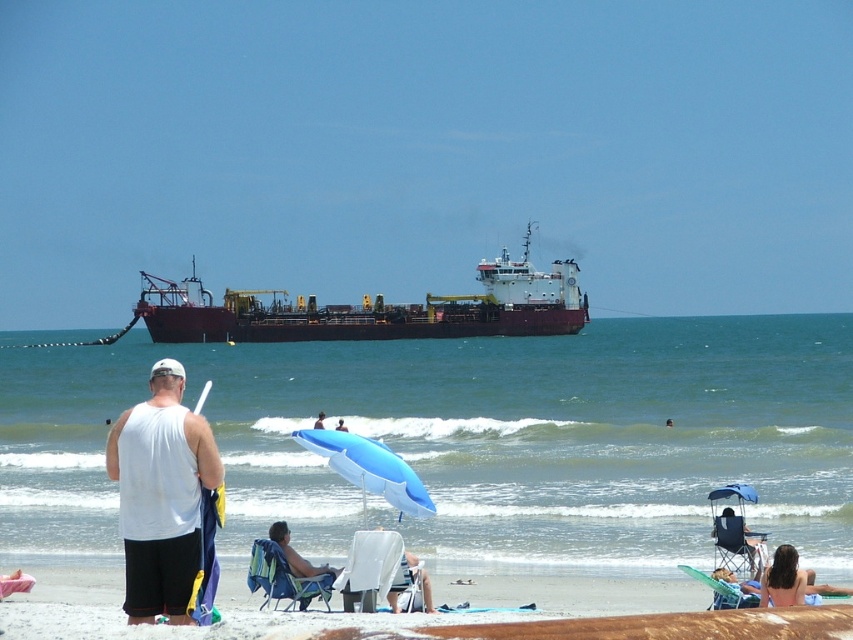
Which is below, dark blue water at center or blue matte umbrella at center?

Positioned lower is blue matte umbrella at center.

Which is behind, point (560, 531) or point (376, 470)?

The point (560, 531) is behind.

Locate an element on the screen. dark blue water at center is located at coordinates (471, 438).

Between white fabric beach chair at lower center and smooth blue umbrella at center, which one appears on the left side from the viewer's perspective?

smooth blue umbrella at center is more to the left.

Who is taller, white fabric beach chair at lower center or smooth blue umbrella at center?

With more height is white fabric beach chair at lower center.

Is point (357, 532) behind point (315, 420)?

No.

Where is `white fabric beach chair at lower center`? white fabric beach chair at lower center is located at coordinates (370, 561).

What do you see at coordinates (161, 496) in the screenshot?
I see `white fabric tank top at center` at bounding box center [161, 496].

Can you confirm if white fabric tank top at center is bigger than blue fabric beach chair at lower right?

Correct, white fabric tank top at center is larger in size than blue fabric beach chair at lower right.

This screenshot has height=640, width=853. I want to click on white fabric tank top at center, so click(161, 496).

Where is `white fabric tank top at center`? The image size is (853, 640). white fabric tank top at center is located at coordinates (161, 496).